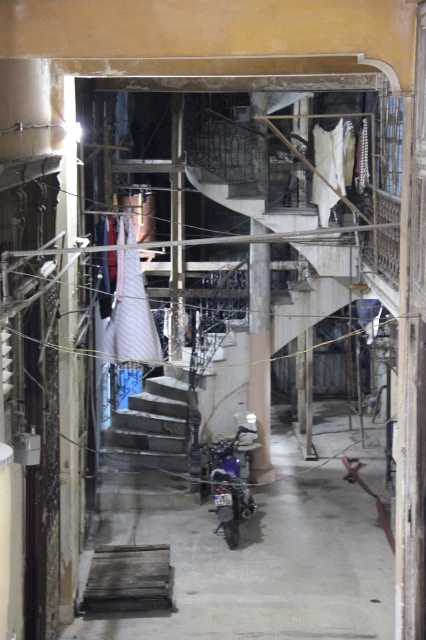
Can you confirm if concrete stairs at center is thinner than shiny blue motorcycle at center?

No, concrete stairs at center is not thinner than shiny blue motorcycle at center.

Is concrete stairs at center positioned in front of shiny blue motorcycle at center?

No, it is behind shiny blue motorcycle at center.

Who is more distant from viewer, (x=175, y=424) or (x=224, y=518)?

Point (x=175, y=424)

Image resolution: width=426 pixels, height=640 pixels. I want to click on concrete stairs at center, so click(146, 449).

Who is more distant from viewer, (152, 419) or (141, 284)?

Positioned behind is point (152, 419).

You are a GUI agent. You are given a task and a screenshot of the screen. Output one action in this format:
    pyautogui.click(x=<x>, y=<y>)
    Task: Click on the concrete stairs at center
    The image size is (426, 640).
    Given the screenshot: What is the action you would take?
    pyautogui.click(x=146, y=449)

Find the location of a particular element. concrete stairs at center is located at coordinates (146, 449).

Based on the photo, is the position of white fabric at center more distant than that of shiny blue motorcycle at center?

Yes, it is.

Who is more forward, (154, 339) or (230, 445)?

Positioned in front is point (154, 339).

Is point (127, 308) farther from viewer compared to point (241, 497)?

Yes, it is behind point (241, 497).

The image size is (426, 640). In order to click on white fabric at center in this screenshot , I will do `click(131, 316)`.